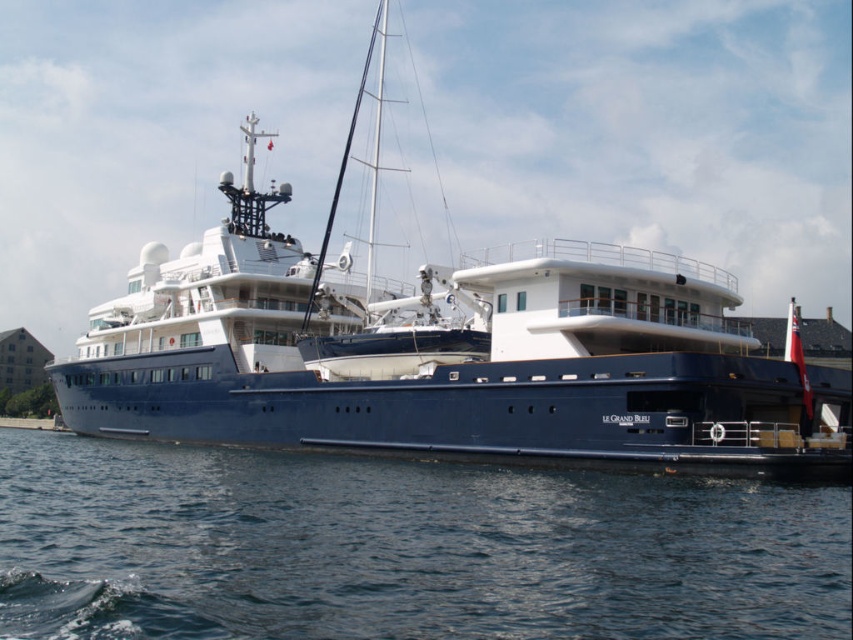
Can you confirm if blue polished yacht at center is bigger than blue water at lower center?

Yes.

Does blue polished yacht at center have a greater height compared to blue water at lower center?

Correct, blue polished yacht at center is much taller as blue water at lower center.

Does point (706, 376) lie behind point (108, 618)?

Yes, it is behind point (108, 618).

At what (x,y) coordinates should I click in order to perform the action: click on blue polished yacht at center. Please return your answer as a coordinate pair (x, y). The image size is (853, 640). Looking at the image, I should click on (450, 353).